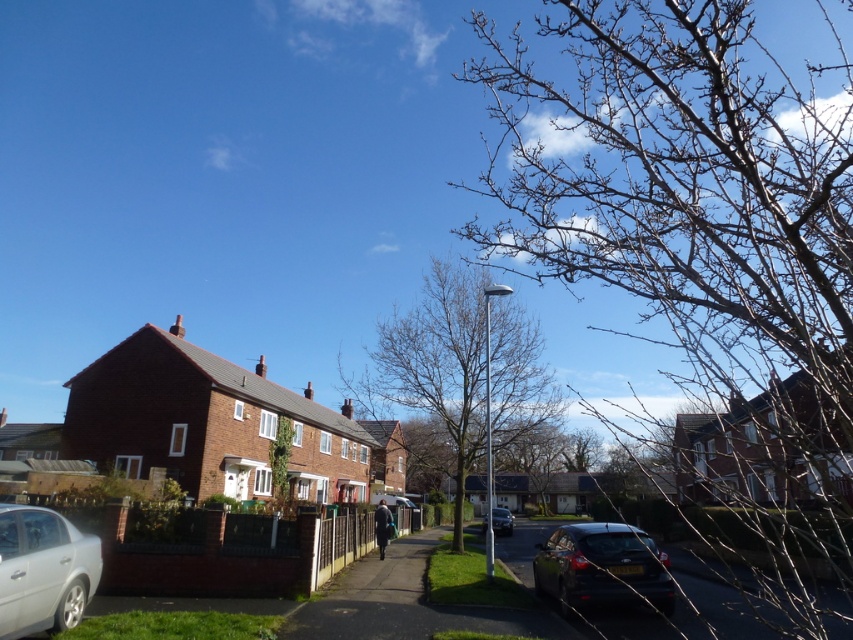
The height and width of the screenshot is (640, 853). What do you see at coordinates (701, 252) in the screenshot?
I see `bare branches at upper right` at bounding box center [701, 252].

Which of these two, bare branches at upper right or shiny black car at lower right, stands taller?

bare branches at upper right is taller.

At what (x,y) coordinates should I click in order to perform the action: click on bare branches at upper right. Please return your answer as a coordinate pair (x, y). This screenshot has height=640, width=853. Looking at the image, I should click on (701, 252).

Locate an element on the screen. bare branches at upper right is located at coordinates (701, 252).

Can you confirm if bare branches at upper right is taller than bare branches at center?

Indeed, bare branches at upper right has a greater height compared to bare branches at center.

Is point (787, 449) positioned after point (456, 310)?

Yes, it is.

Between point (526, 136) and point (425, 449), which one is positioned in front?

Positioned in front is point (425, 449).

I want to click on bare branches at upper right, so click(701, 252).

Which is behind, point (668, 13) or point (25, 605)?

The point (668, 13) is more distant.

Is bare branches at upper right taller than silver metallic car at lower left?

Yes, bare branches at upper right is taller than silver metallic car at lower left.

Locate an element on the screen. This screenshot has width=853, height=640. bare branches at upper right is located at coordinates (701, 252).

At what (x,y) coordinates should I click in order to perform the action: click on bare branches at upper right. Please return your answer as a coordinate pair (x, y). Image resolution: width=853 pixels, height=640 pixels. Looking at the image, I should click on (701, 252).